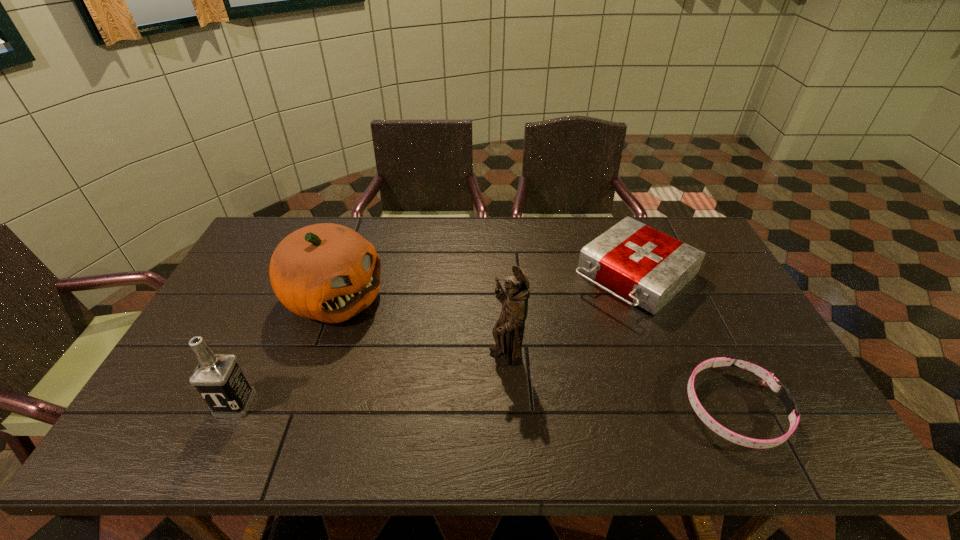
Locate an element on the screen. The height and width of the screenshot is (540, 960). vodka is located at coordinates (218, 378).

The width and height of the screenshot is (960, 540). In order to click on dog collar in this screenshot , I will do `click(768, 379)`.

Locate an element on the screen. the fourth tallest object is located at coordinates (648, 267).

Locate an element on the screen. pumpkin is located at coordinates (327, 272).

Locate an element on the screen. the tallest object is located at coordinates (508, 332).

Identify the location of figurine. (508, 332).

Locate an element on the screen. This screenshot has width=960, height=540. free space located 0.060m with the buckle on the dog collar is located at coordinates (805, 408).

This screenshot has width=960, height=540. Find the location of `vacant space located 0.250m on the front side of the fourth tallest object`. vacant space located 0.250m on the front side of the fourth tallest object is located at coordinates (541, 352).

At what (x,y) coordinates should I click in order to perform the action: click on vacant space located 0.360m on the front side of the fourth tallest object. Please return your answer as a coordinate pair (x, y). This screenshot has width=960, height=540. Looking at the image, I should click on (513, 376).

This screenshot has width=960, height=540. Find the location of `free space located 0.070m on the front side of the fourth tallest object`. free space located 0.070m on the front side of the fourth tallest object is located at coordinates [582, 319].